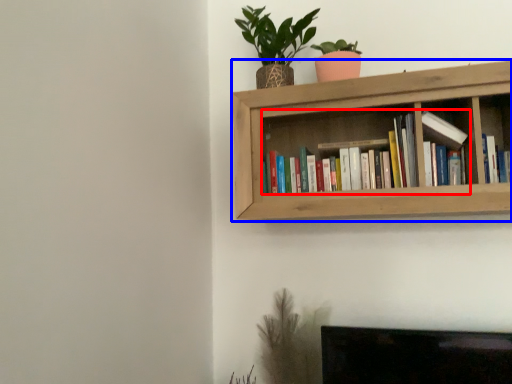
Question: Which object appears closest to the camera in this image, book (highlighted by a red box) or shelf (highlighted by a blue box)?

Choices:
 (A) book
 (B) shelf

Answer: (B)